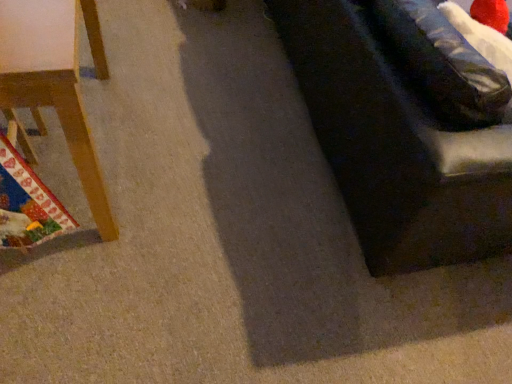
What are the coordinates of `wooden chair at left` in the screenshot? It's located at (55, 81).

What do you see at coordinates (55, 81) in the screenshot?
I see `wooden chair at left` at bounding box center [55, 81].

This screenshot has height=384, width=512. What do you see at coordinates (395, 146) in the screenshot? I see `dark fabric couch at right` at bounding box center [395, 146].

In order to face dark fabric couch at right, should I rotate leftwards or rightwards?

Turn right approximately 19.983 degrees to face it.

Measure the distance between point (478, 165) and camera.

Point (478, 165) and camera are 98.70 centimeters apart.

Image resolution: width=512 pixels, height=384 pixels. In order to click on dark fabric couch at right in this screenshot , I will do (395, 146).

Image resolution: width=512 pixels, height=384 pixels. I want to click on wooden chair at left, so click(x=55, y=81).

Based on the photo, which object is positioned more to the left, wooden chair at left or dark fabric couch at right?

From the viewer's perspective, wooden chair at left appears more on the left side.

Is wooden chair at left in front of dark fabric couch at right?

Yes, it is.

Is point (90, 137) closer to viewer compared to point (345, 195)?

Yes.

From the image's perspective, would you say wooden chair at left is positioned over dark fabric couch at right?

Actually, wooden chair at left appears below dark fabric couch at right in the image.

From a real-world perspective, is wooden chair at left below dark fabric couch at right?

Yes, from a real-world perspective, wooden chair at left is under dark fabric couch at right.

Considering the sizes of objects wooden chair at left and dark fabric couch at right in the image provided, who is wider, wooden chair at left or dark fabric couch at right?

Wider between the two is dark fabric couch at right.

Consider the image. From their relative heights in the image, would you say wooden chair at left is taller or shorter than dark fabric couch at right?

Clearly, wooden chair at left is shorter compared to dark fabric couch at right.

Considering the relative sizes of wooden chair at left and dark fabric couch at right in the image provided, is wooden chair at left smaller than dark fabric couch at right?

Indeed, wooden chair at left has a smaller size compared to dark fabric couch at right.

Is wooden chair at left surrounding dark fabric couch at right?

No, dark fabric couch at right is not a part of wooden chair at left.

Is wooden chair at left not near dark fabric couch at right?

wooden chair at left is actually quite close to dark fabric couch at right.

Could you tell me if wooden chair at left is turned towards dark fabric couch at right?

Yes, wooden chair at left is facing dark fabric couch at right.

This screenshot has height=384, width=512. Find the location of `furniture located underneath the dark fabric couch at right (from a real-world perspective)`. furniture located underneath the dark fabric couch at right (from a real-world perspective) is located at coordinates (55, 81).

Is dark fabric couch at right to the left of wooden chair at left from the viewer's perspective?

In fact, dark fabric couch at right is to the right of wooden chair at left.

Does dark fabric couch at right lie in front of wooden chair at left?

That is False.

Which is farther from the camera, (398, 185) or (73, 44)?

The point (398, 185) is more distant.

From the image's perspective, between dark fabric couch at right and wooden chair at left, who is located below?

wooden chair at left appears lower in the image.

From a real-world perspective, is dark fabric couch at right physically below wooden chair at left?

Incorrect, from a real-world perspective, dark fabric couch at right is higher than wooden chair at left.

In terms of width, does dark fabric couch at right look wider or thinner when compared to wooden chair at left?

Clearly, dark fabric couch at right has more width compared to wooden chair at left.

Does dark fabric couch at right have a lesser height compared to wooden chair at left?

No.

Considering the relative sizes of dark fabric couch at right and wooden chair at left in the image provided, is dark fabric couch at right smaller than wooden chair at left?

Actually, dark fabric couch at right might be larger than wooden chair at left.

Is dark fabric couch at right surrounding wooden chair at left?

No, wooden chair at left is located outside of dark fabric couch at right.

Are dark fabric couch at right and wooden chair at left far apart?

No, dark fabric couch at right is in close proximity to wooden chair at left.

Is dark fabric couch at right positioned with its back to wooden chair at left?

Absolutely, dark fabric couch at right is directed away from wooden chair at left.

What's the angular difference between dark fabric couch at right and wooden chair at left's facing directions?

The angular difference between dark fabric couch at right and wooden chair at left is 0.73 degrees.

Measure the distance from dark fabric couch at right to wooden chair at left.

dark fabric couch at right is 34.89 inches from wooden chair at left.

Find the location of `furniture on the left of dark fabric couch at right`. furniture on the left of dark fabric couch at right is located at coordinates (55, 81).

Image resolution: width=512 pixels, height=384 pixels. I want to click on furniture below the dark fabric couch at right (from a real-world perspective), so click(x=55, y=81).

Where is `studio couch above the wooden chair at left (from the image's perspective)`? The width and height of the screenshot is (512, 384). studio couch above the wooden chair at left (from the image's perspective) is located at coordinates (395, 146).